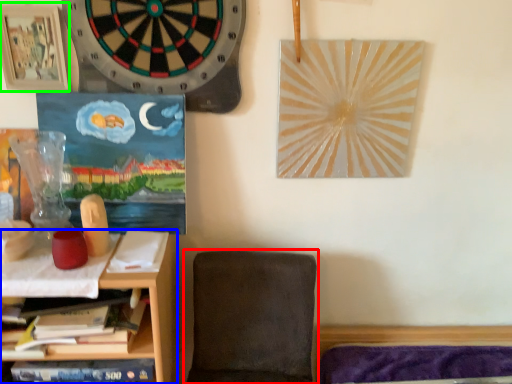
Question: Estimate the real-world distances between objects in this image. Which object is closer to chair (highlighted by a red box), shelf (highlighted by a blue box) or picture frame (highlighted by a green box)?

Choices:
 (A) shelf
 (B) picture frame

Answer: (A)